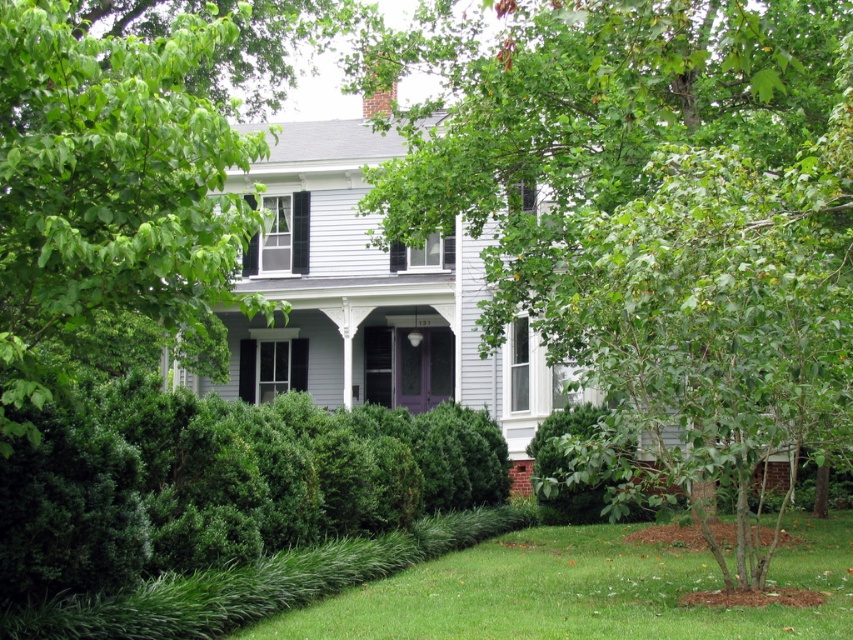
Describe the element at coordinates (583, 589) in the screenshot. I see `green grass at lower center` at that location.

Is green grass at lower center below green leafy hedge at lower center?

Correct, green grass at lower center is located below green leafy hedge at lower center.

Measure the distance between point (704,561) and camera.

They are 14.49 meters apart.

Locate an element on the screen. This screenshot has height=640, width=853. green grass at lower center is located at coordinates (583, 589).

Can you confirm if green leafy tree at center is positioned above green grass at lower center?

Correct, green leafy tree at center is located above green grass at lower center.

How much distance is there between green leafy tree at center and green grass at lower center?

green leafy tree at center and green grass at lower center are 4.88 meters apart from each other.

Is point (544, 273) positioned in front of point (529, 627)?

No, it is behind (529, 627).

Identify the location of green leafy tree at center. The width and height of the screenshot is (853, 640). (657, 225).

Between green leafy tree at left and green grass at lower center, which one has more height?

Standing taller between the two is green leafy tree at left.

Can you confirm if green leafy tree at left is positioned to the right of green grass at lower center?

No, green leafy tree at left is not to the right of green grass at lower center.

Where is `green leafy tree at left`? The image size is (853, 640). green leafy tree at left is located at coordinates (109, 186).

The width and height of the screenshot is (853, 640). I want to click on green leafy tree at left, so click(x=109, y=186).